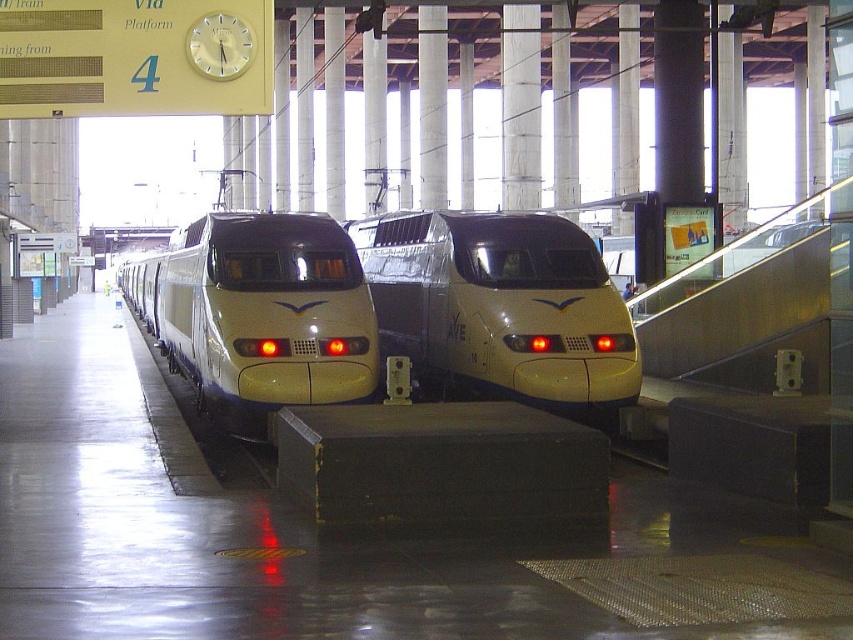
Question: Which object is closer to the camera taking this photo?

Choices:
 (A) white glossy train at center
 (B) white glossy passenger train at center

Answer: (A)

Question: Which point appears farthest from the camera in this image?

Choices:
 (A) (445, 330)
 (B) (225, 262)

Answer: (A)

Question: Which of the following is the farthest from the observer?

Choices:
 (A) white glossy train at center
 (B) white glossy passenger train at center

Answer: (B)

Question: Does white glossy passenger train at center appear over white glossy train at center?

Choices:
 (A) no
 (B) yes

Answer: (B)

Question: Is white glossy passenger train at center to the left of white glossy train at center from the viewer's perspective?

Choices:
 (A) yes
 (B) no

Answer: (B)

Question: Does white glossy passenger train at center have a larger size compared to white glossy train at center?

Choices:
 (A) no
 (B) yes

Answer: (A)